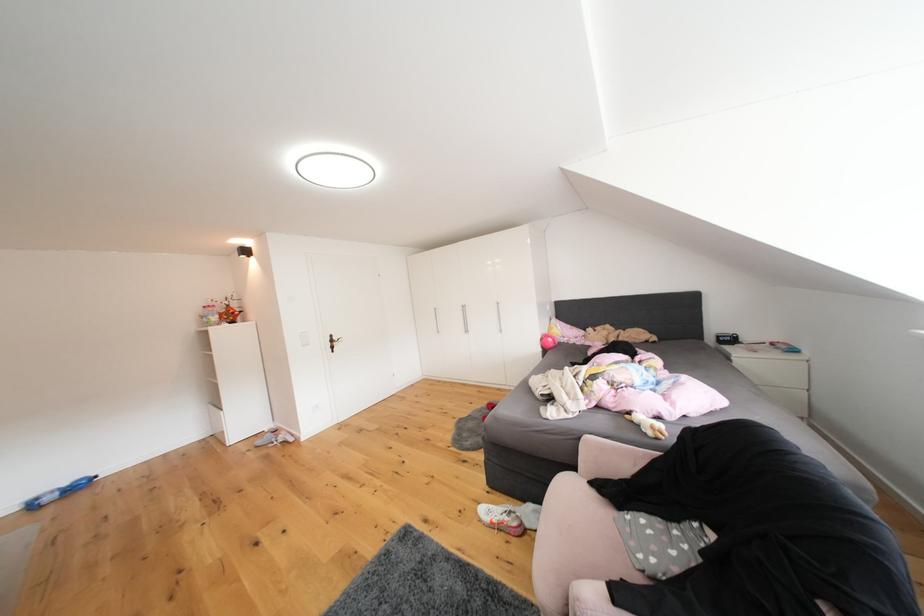
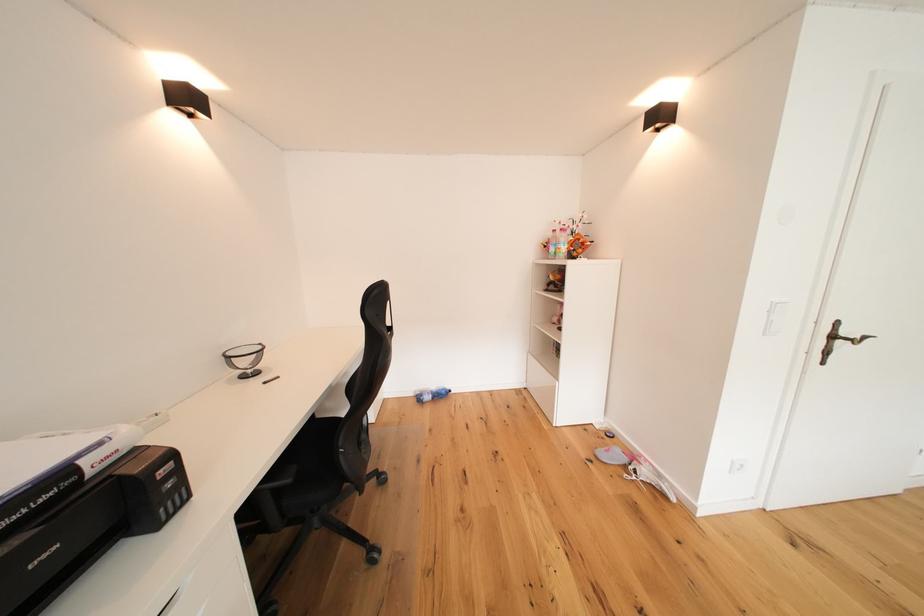
The point at (26,513) is marked in the first image. Where is the corresponding point in the second image?

(421, 399)